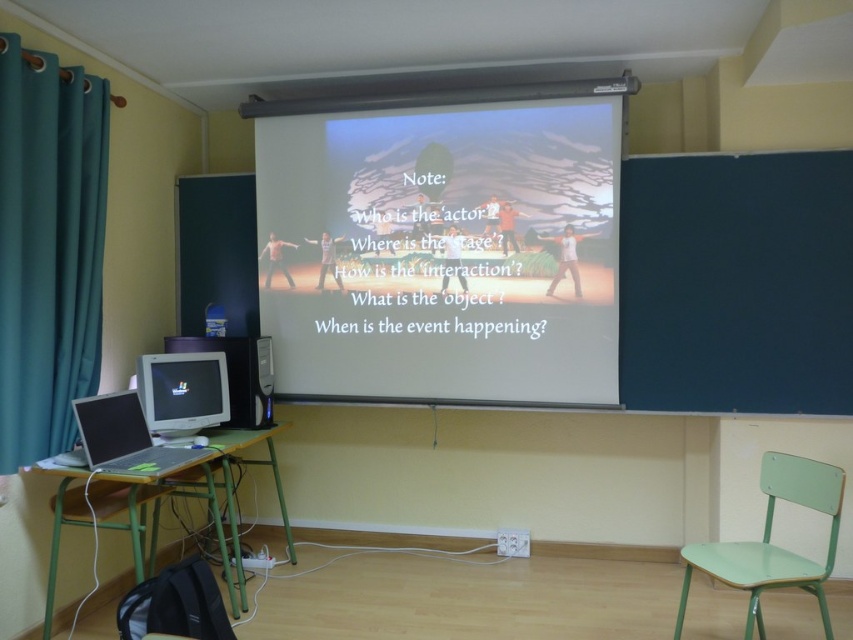
You are a student sitting at the desk with the matte silver monitor at lower left and want to adjust the lighting in the classroom. Since the teal fabric curtain at left is above your monitor, can you reach it easily from your current position?

The teal fabric curtain at left is located above the matte silver monitor at lower left, so it is positioned higher up and further away from your current position at the desk. You may need to stand or move closer to reach it comfortably.

You are a student sitting in the classroom and want to see both the white matte projection screen at center and the matte plastic monitor at lower left clearly. Which one do you need to move closer to your seat?

You need to move closer to the matte plastic monitor at lower left because it is behind the white matte projection screen at center, so it might be partially blocked from your view unless you move closer.

You are a student in the classroom and need to decide whether to place your backpack between the teal fabric curtain at left and the matte silver monitor at lower left. Can you fit your backpack there if it is 15 cm thick?

The teal fabric curtain at left is thinner than the matte silver monitor at lower left. Since the backpack is 15 cm thick, you need to check the available space between them. However, the description only states the relative thickness of the objects, not the exact dimensions of the gap. Without knowing the exact distance between them, it is uncertain if the backpack will fit.